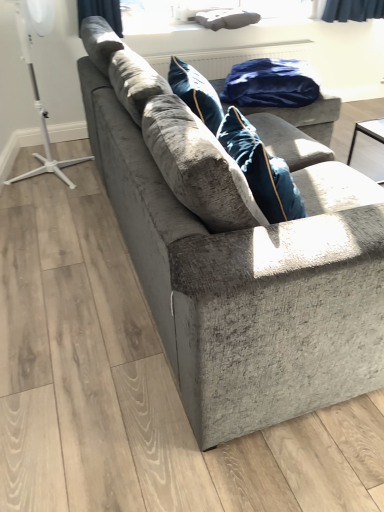
What is the approximate width of blue velvet blanket at upper center?

blue velvet blanket at upper center is 22.33 inches in width.

What do you see at coordinates (36, 81) in the screenshot? The width and height of the screenshot is (384, 512). I see `white plastic tripod at left` at bounding box center [36, 81].

Find the location of a particular element. velvet gray couch at center is located at coordinates (238, 257).

Can you confirm if white plastic tripod at left is shorter than velvet gray couch at center?

No, white plastic tripod at left is not shorter than velvet gray couch at center.

Based on the photo, is white plastic tripod at left facing away from velvet gray couch at center?

No.

Considering the sizes of objects white plastic tripod at left and velvet gray couch at center in the image provided, who is thinner, white plastic tripod at left or velvet gray couch at center?

white plastic tripod at left is thinner.

Which object is positioned more to the right, white plastic tripod at left or blue velvet blanket at upper center?

From the viewer's perspective, blue velvet blanket at upper center appears more on the right side.

From the picture: How much distance is there between white plastic tripod at left and blue velvet blanket at upper center?

The distance of white plastic tripod at left from blue velvet blanket at upper center is 4.02 feet.

Are white plastic tripod at left and blue velvet blanket at upper center far apart?

white plastic tripod at left is positioned a significant distance from blue velvet blanket at upper center.

Is blue velvet blanket at upper center located within white plastic tripod at left?

No, blue velvet blanket at upper center is located outside of white plastic tripod at left.

Looking at the image, does transparent glass window screen at upper center seem bigger or smaller compared to blue velvet blanket at upper center?

transparent glass window screen at upper center is smaller than blue velvet blanket at upper center.

Is transparent glass window screen at upper center at the right side of blue velvet blanket at upper center?

No.

Which is in front, point (182, 19) or point (305, 105)?

The point (305, 105) is more forward.

Where is `window screen lying on the left of blue velvet blanket at upper center`? The image size is (384, 512). window screen lying on the left of blue velvet blanket at upper center is located at coordinates (202, 12).

Considering the positions of point (236, 92) and point (51, 25), is point (236, 92) closer or farther from the camera than point (51, 25)?

Clearly, point (236, 92) is closer to the camera than point (51, 25).

Is blue velvet blanket at upper center inside the boundaries of white plastic tripod at left, or outside?

blue velvet blanket at upper center is not enclosed by white plastic tripod at left.

Measure the distance between blue velvet blanket at upper center and white plastic tripod at left.

blue velvet blanket at upper center is 1.22 meters away from white plastic tripod at left.

Is blue velvet blanket at upper center far away from white plastic tripod at left?

Indeed, blue velvet blanket at upper center is not near white plastic tripod at left.

Can you confirm if velvet gray couch at center is positioned to the right of transparent glass window screen at upper center?

Yes, velvet gray couch at center is to the right of transparent glass window screen at upper center.

Would you say transparent glass window screen at upper center is part of velvet gray couch at center's contents?

Definitely not — transparent glass window screen at upper center is not inside velvet gray couch at center.

Is velvet gray couch at center shorter than transparent glass window screen at upper center?

No.

Would you consider velvet gray couch at center to be distant from transparent glass window screen at upper center?

Yes, velvet gray couch at center is far from transparent glass window screen at upper center.

Is white plastic tripod at left oriented towards transparent glass window screen at upper center?

No, white plastic tripod at left is not aimed at transparent glass window screen at upper center.

Is point (74, 162) closer or farther from the camera than point (136, 27)?

Point (74, 162) is positioned closer to the camera compared to point (136, 27).

Does white plastic tripod at left come behind transparent glass window screen at upper center?

That is False.

Can you confirm if transparent glass window screen at upper center is positioned to the right of white plastic tripod at left?

Indeed, transparent glass window screen at upper center is positioned on the right side of white plastic tripod at left.

Locate an element on the screen. window screen above the white plastic tripod at left (from the image's perspective) is located at coordinates (202, 12).

Consider the image. Which of these two, transparent glass window screen at upper center or white plastic tripod at left, stands shorter?

transparent glass window screen at upper center.

Can you confirm if transparent glass window screen at upper center is smaller than white plastic tripod at left?

Indeed, transparent glass window screen at upper center has a smaller size compared to white plastic tripod at left.

Where is `fan on the left of velvet gray couch at center`? This screenshot has width=384, height=512. fan on the left of velvet gray couch at center is located at coordinates (36, 81).

At what (x,y) coordinates should I click in order to perform the action: click on fan in front of the blue velvet blanket at upper center. Please return your answer as a coordinate pair (x, y). This screenshot has height=512, width=384. Looking at the image, I should click on (36, 81).

When comparing their distances from velvet gray couch at center, does blue velvet blanket at upper center or transparent glass window screen at upper center seem further?

The object further to velvet gray couch at center is transparent glass window screen at upper center.

Considering their positions, is white plastic tripod at left positioned closer to blue velvet blanket at upper center than transparent glass window screen at upper center?

transparent glass window screen at upper center is positioned closer to the anchor blue velvet blanket at upper center.

When comparing their distances from white plastic tripod at left, does transparent glass window screen at upper center or velvet gray couch at center seem further?

velvet gray couch at center is positioned further to the anchor white plastic tripod at left.

Based on their spatial positions, is velvet gray couch at center or white plastic tripod at left closer to transparent glass window screen at upper center?

Based on the image, white plastic tripod at left appears to be nearer to transparent glass window screen at upper center.

Based on their spatial positions, is white plastic tripod at left or transparent glass window screen at upper center further from velvet gray couch at center?

transparent glass window screen at upper center.

Estimate the real-world distances between objects in this image. Which object is further from transparent glass window screen at upper center, blue velvet blanket at upper center or white plastic tripod at left?

The object further to transparent glass window screen at upper center is white plastic tripod at left.

Estimate the real-world distances between objects in this image. Which object is closer to transparent glass window screen at upper center, white plastic tripod at left or blue velvet blanket at upper center?

The object closer to transparent glass window screen at upper center is blue velvet blanket at upper center.

Considering their positions, is white plastic tripod at left positioned closer to velvet gray couch at center than blue velvet blanket at upper center?

blue velvet blanket at upper center.

The image size is (384, 512). What are the coordinates of `material located between velvet gray couch at center and transparent glass window screen at upper center in the depth direction` in the screenshot? It's located at (270, 84).

This screenshot has height=512, width=384. I want to click on fan between velvet gray couch at center and blue velvet blanket at upper center from front to back, so click(x=36, y=81).

This screenshot has width=384, height=512. In order to click on window screen located between white plastic tripod at left and blue velvet blanket at upper center in the left-right direction in this screenshot , I will do `click(202, 12)`.

Identify the location of fan located between velvet gray couch at center and transparent glass window screen at upper center in the depth direction. This screenshot has height=512, width=384. [x=36, y=81].